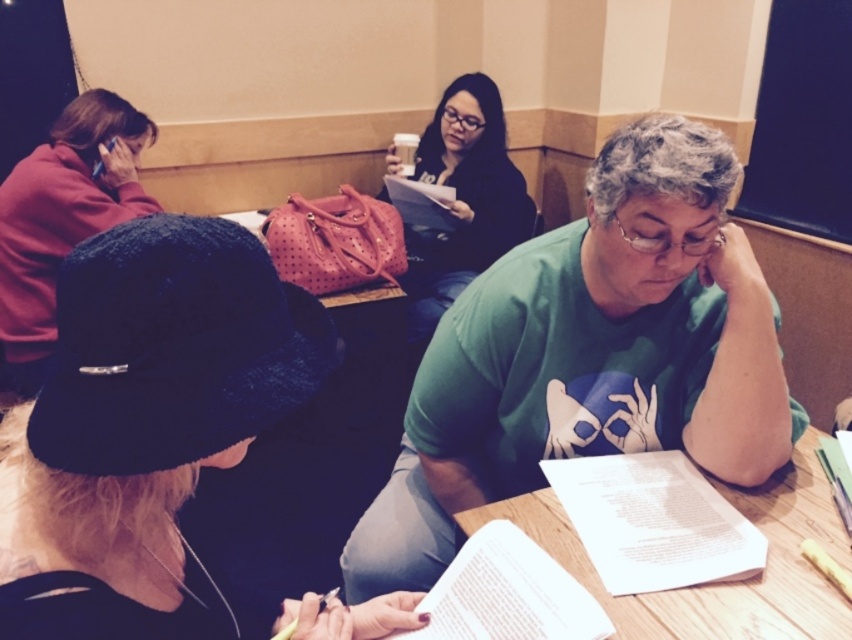
Question: Does black felt hat at upper left appear over matte black shirt at center?

Choices:
 (A) no
 (B) yes

Answer: (A)

Question: Based on their relative distances, which object is nearer to the black felt hat at upper left?

Choices:
 (A) wooden table at center
 (B) matte red hoodie at upper left

Answer: (A)

Question: Does matte red hoodie at upper left appear over matte black shirt at center?

Choices:
 (A) yes
 (B) no

Answer: (B)

Question: Which point is closer to the camera?

Choices:
 (A) (722, 483)
 (B) (9, 240)
 (C) (469, 104)

Answer: (A)

Question: Can you confirm if green matte shirt at center is positioned above matte red hoodie at upper left?

Choices:
 (A) no
 (B) yes

Answer: (A)

Question: Considering the real-world distances, which object is farthest from the wooden table at center?

Choices:
 (A) green matte shirt at center
 (B) matte black shirt at center

Answer: (B)